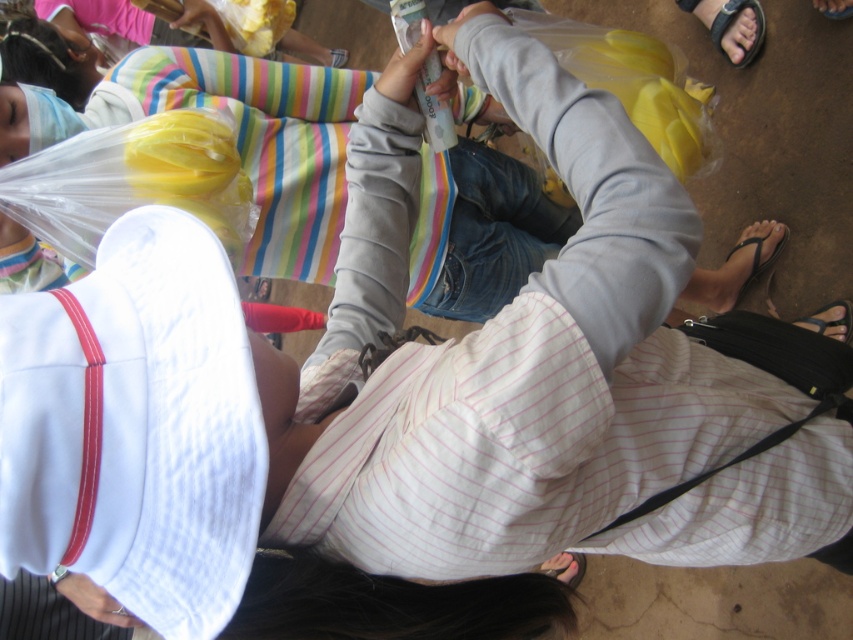
You are standing at the edge of the scene and want to place a small item between the smooth gray hoodie at center and the matte yellow plastic bag at upper center. According to their positions, which object should you place the item closer to?

The smooth gray hoodie at center is positioned on the right side of matte yellow plastic bag at upper center, so to place the item between them, you should position it closer to the matte yellow plastic bag at upper center since the hoodie is to its right.

You are a delivery person who needs to place a small package between the smooth gray hoodie at center and the white fabric at lower left. The package is 18 inches long. Will it fit between them without overlapping either object?

The smooth gray hoodie at center and white fabric at lower left are 21.25 inches apart from each other. Since the package is 18 inches long, it will fit between them as there is enough space without overlapping either object.